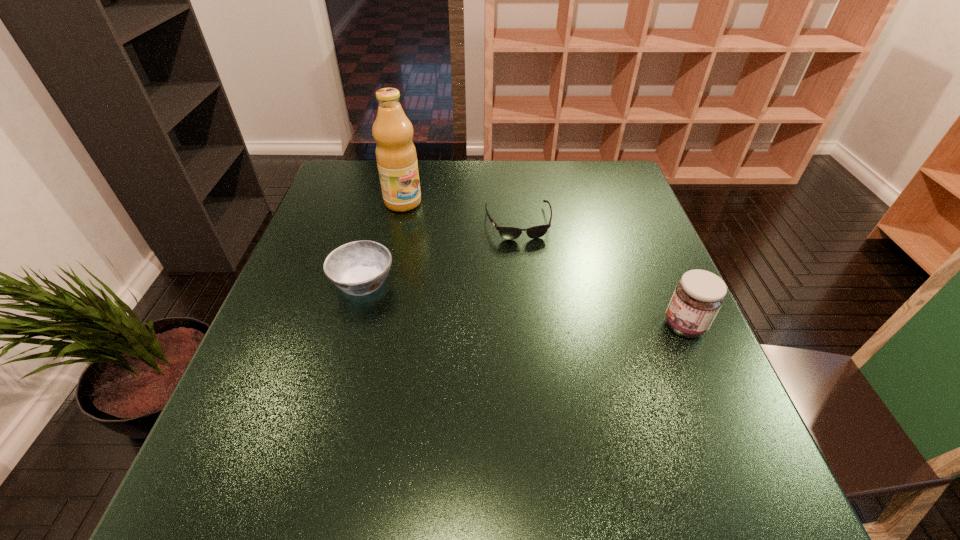
Identify the location of the third tallest object. (358, 268).

The height and width of the screenshot is (540, 960). What are the coordinates of `the third farthest object` in the screenshot? It's located at (358, 268).

You are a GUI agent. You are given a task and a screenshot of the screen. Output one action in this format:
    pyautogui.click(x=<x>, y=<y>)
    Task: Click on the nearest object
    
    Given the screenshot: What is the action you would take?
    pyautogui.click(x=698, y=296)

Where is `the third shortest object`? Image resolution: width=960 pixels, height=540 pixels. the third shortest object is located at coordinates (698, 296).

The image size is (960, 540). Identify the location of the tallest object. (396, 156).

What are the coordinates of `the third object from left to right` in the screenshot? It's located at (510, 233).

At what (x,y) coordinates should I click in order to perform the action: click on the shortest object. Please return your answer as a coordinate pair (x, y). Looking at the image, I should click on (510, 233).

Where is `blank area located 0.200m on the right of the second nearest object`? The image size is (960, 540). blank area located 0.200m on the right of the second nearest object is located at coordinates (480, 282).

Locate an element on the screen. free location located on the front label of the second tallest object is located at coordinates (556, 326).

The width and height of the screenshot is (960, 540). I want to click on vacant space located 0.190m on the front label of the second tallest object, so click(x=574, y=326).